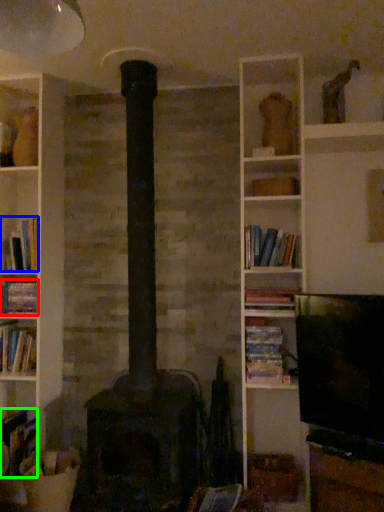
Question: Based on their relative distances, which object is farther from book (highlighted by a red box)? Choose from book (highlighted by a blue box) and book (highlighted by a green box).

Choices:
 (A) book
 (B) book

Answer: (B)